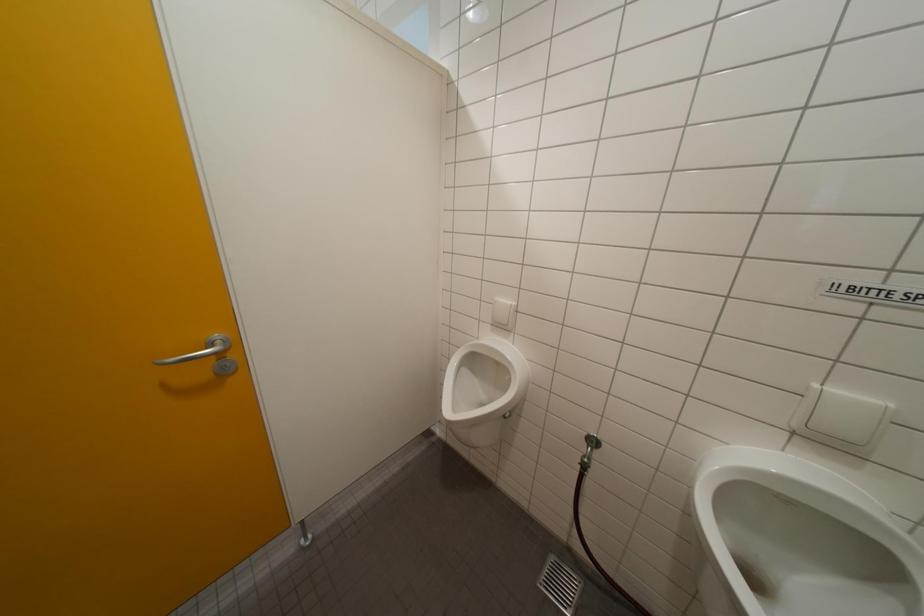
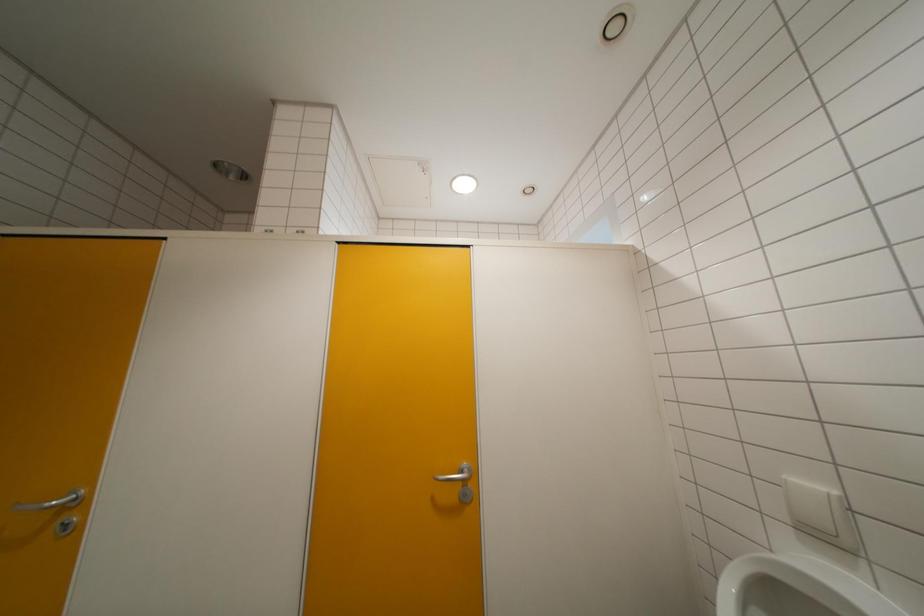
Looking at this image, the first image is from the beginning of the video and the second image is from the end. How did the camera likely rotate when shooting the video?

The camera rotated toward left-up.